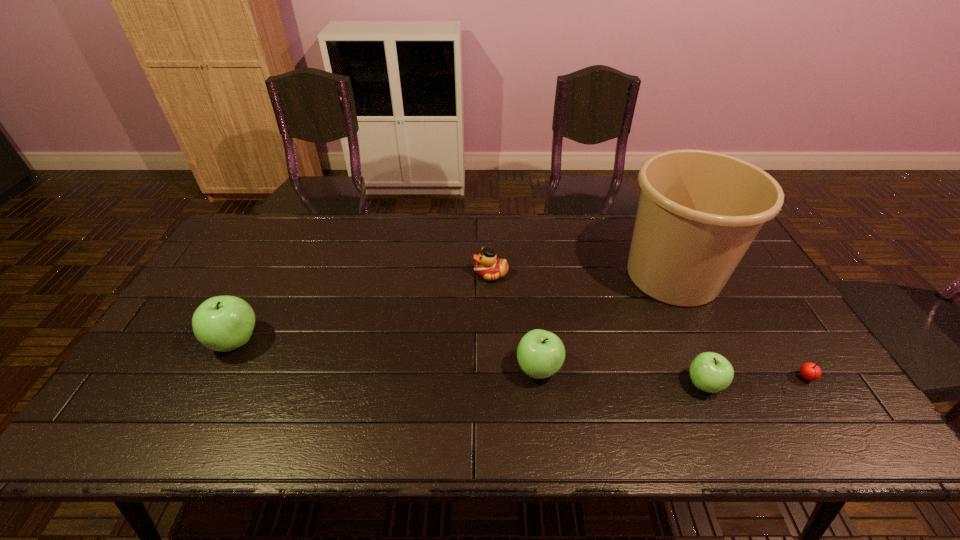
This screenshot has height=540, width=960. In order to click on apple that stands as the third closest to the cherry in this screenshot , I will do `click(223, 323)`.

Where is `free location that satisfies the following two spatial constraints: 1. on the face of the fifth object from right to left; 2. on the back side of the cherry`? This screenshot has width=960, height=540. free location that satisfies the following two spatial constraints: 1. on the face of the fifth object from right to left; 2. on the back side of the cherry is located at coordinates coord(493,379).

Locate an element on the screen. The width and height of the screenshot is (960, 540). free spot that satisfies the following two spatial constraints: 1. on the front side of the rightmost apple; 2. on the right side of the second apple from left to right is located at coordinates (540, 384).

Find the location of a particular element. vacant point that satisfies the following two spatial constraints: 1. on the back side of the shortest apple; 2. on the face of the fifth object from right to left is located at coordinates (657, 274).

The width and height of the screenshot is (960, 540). I want to click on free space that satisfies the following two spatial constraints: 1. on the face of the duck; 2. on the left side of the tallest object, so click(491, 275).

Image resolution: width=960 pixels, height=540 pixels. I want to click on blank area in the image that satisfies the following two spatial constraints: 1. on the face of the duck; 2. on the back side of the rightmost apple, so click(x=493, y=384).

Image resolution: width=960 pixels, height=540 pixels. I want to click on free space that satisfies the following two spatial constraints: 1. on the front side of the shortest apple; 2. on the right side of the second apple from left to right, so click(540, 384).

At what (x,y) coordinates should I click in order to perform the action: click on free region that satisfies the following two spatial constraints: 1. on the face of the duck; 2. on the left side of the rightmost apple. Please return your answer as a coordinate pair (x, y). Looking at the image, I should click on (493, 384).

At what (x,y) coordinates should I click in order to perform the action: click on vacant point that satisfies the following two spatial constraints: 1. on the back side of the second shortest apple; 2. on the face of the duck. Please return your answer as a coordinate pair (x, y). Looking at the image, I should click on (528, 274).

You are a GUI agent. You are given a task and a screenshot of the screen. Output one action in this format:
    pyautogui.click(x=<x>, y=<y>)
    Task: Click on the vacant space that satisfies the following two spatial constraints: 1. on the face of the second object from left to right; 2. on the left side of the shortest apple
    
    Given the screenshot: What is the action you would take?
    pyautogui.click(x=493, y=384)